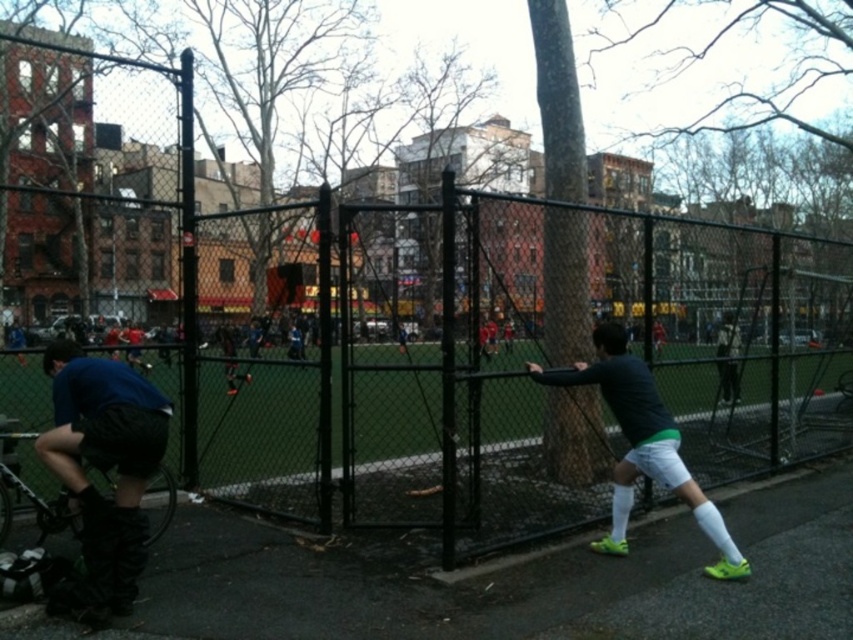
Question: Where is matte blue shirt at lower left located in relation to dark gray matte shirt at right in the image?

Choices:
 (A) left
 (B) right

Answer: (A)

Question: Is matte blue shirt at lower left wider than dark gray matte shirt at right?

Choices:
 (A) no
 (B) yes

Answer: (A)

Question: Which point appears farthest from the camera in this image?

Choices:
 (A) (117, 403)
 (B) (601, 380)

Answer: (B)

Question: Is the position of matte blue shirt at lower left more distant than that of dark gray matte shirt at right?

Choices:
 (A) no
 (B) yes

Answer: (A)

Question: Which of the following is the farthest from the observer?

Choices:
 (A) (67, 486)
 (B) (709, 524)

Answer: (B)